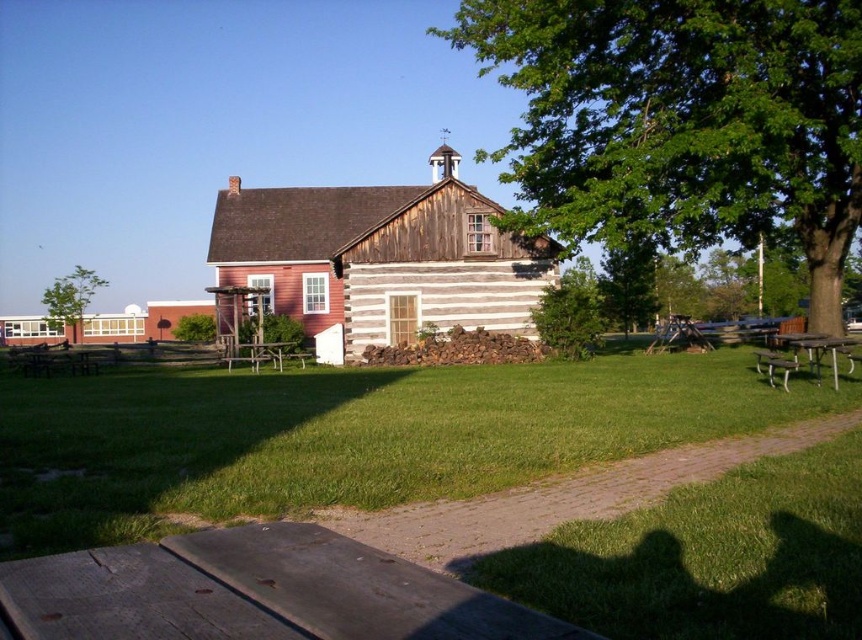
Question: Which point appears farthest from the camera in this image?

Choices:
 (A) (701, 122)
 (B) (548, 314)
 (C) (535, 282)

Answer: (C)

Question: Which object appears farthest from the camera in this image?

Choices:
 (A) metallic silver park bench at lower right
 (B) white wooden log cabin at center
 (C) green leafy tree at left

Answer: (C)

Question: Is green textured log cabin at center below black metal picnic table at lower right?

Choices:
 (A) yes
 (B) no

Answer: (B)

Question: Which of these objects is positioned farthest from the white plastic picnic table at center?

Choices:
 (A) white plastic park bench at lower right
 (B) metallic silver park bench at lower right
 (C) black metal picnic table at lower right
 (D) white wooden log cabin at center

Answer: (C)

Question: Is white wooden log cabin at center smaller than metallic silver park bench at lower right?

Choices:
 (A) no
 (B) yes

Answer: (A)

Question: Can you confirm if green leafy tree at left is positioned above black metal picnic table at lower right?

Choices:
 (A) no
 (B) yes

Answer: (B)